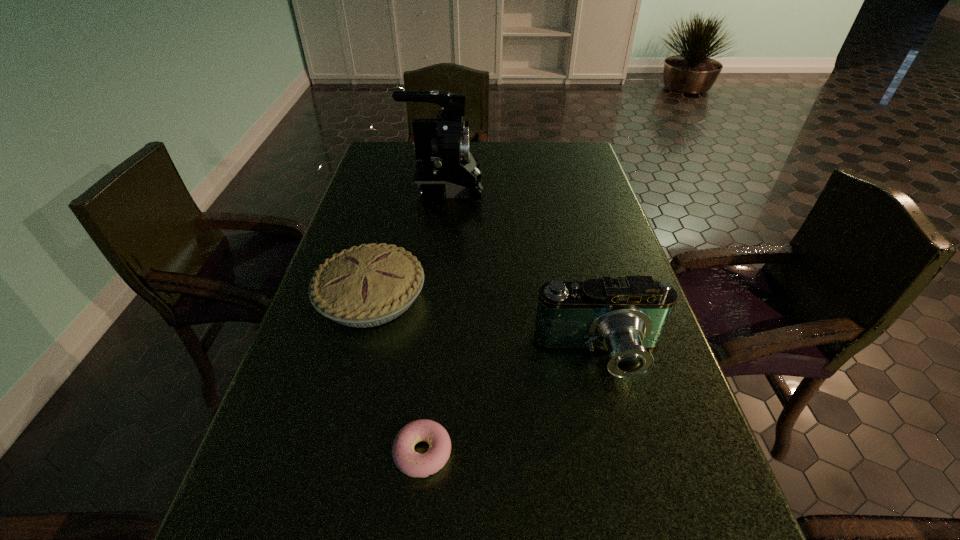
Where is `the taller camcorder`? The image size is (960, 540). the taller camcorder is located at coordinates (445, 168).

Locate an element on the screen. the left camcorder is located at coordinates (445, 168).

You are a GUI agent. You are given a task and a screenshot of the screen. Output one action in this format:
    pyautogui.click(x=<x>, y=<y>)
    Task: Click on the shorter camcorder
    This screenshot has width=960, height=540.
    Given the screenshot: What is the action you would take?
    pyautogui.click(x=627, y=316)

Find the location of a particular element. This screenshot has width=960, height=540. the nearer camcorder is located at coordinates tap(627, 316).

Where is `the third tallest object`? Image resolution: width=960 pixels, height=540 pixels. the third tallest object is located at coordinates (372, 284).

This screenshot has height=540, width=960. I want to click on the shortest object, so click(407, 460).

This screenshot has width=960, height=540. Identify the location of the nearest object. (407, 460).

At what (x,y) coordinates should I click in order to perform the action: click on free spot located on the lens mount of the farther camcorder. Please return your answer as a coordinate pair (x, y). This screenshot has height=540, width=960. Looking at the image, I should click on (512, 188).

Identify the location of free space located on the front-facing side of the nearer camcorder. This screenshot has width=960, height=540. click(621, 438).

Where is `vacant space situated on the right of the pie`? Image resolution: width=960 pixels, height=540 pixels. vacant space situated on the right of the pie is located at coordinates (491, 298).